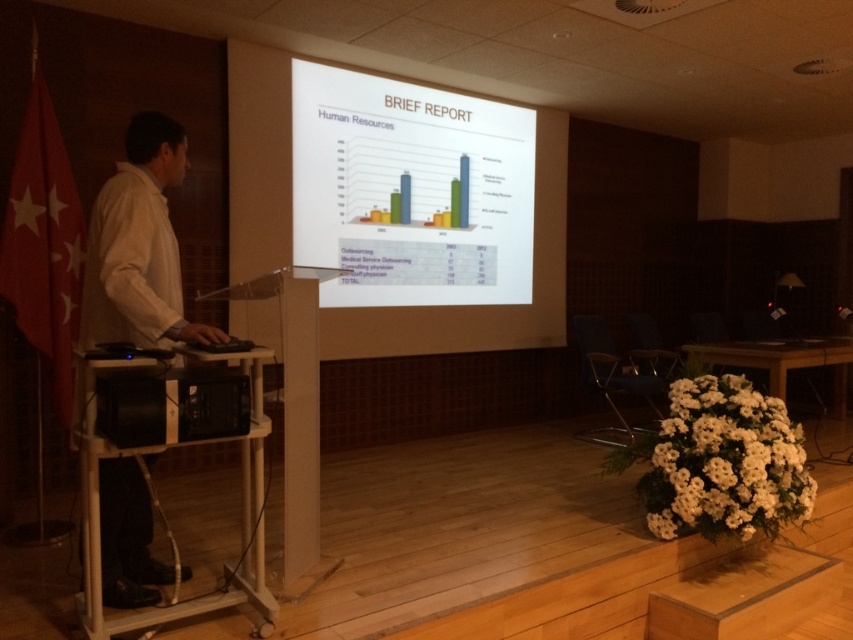
Who is more forward, (151, 257) or (199, 358)?

Point (199, 358) is in front.

Can you confirm if white shirt at left is thinner than wooden podium at center?

Yes.

Does point (96, 273) come farther from viewer compared to point (253, 538)?

No, it is not.

I want to click on white shirt at left, so click(138, 244).

Who is higher up, white glossy projector screen at upper center or wooden podium at center?

white glossy projector screen at upper center is higher up.

Does white glossy projector screen at upper center appear on the left side of wooden podium at center?

Incorrect, white glossy projector screen at upper center is not on the left side of wooden podium at center.

Is point (283, 113) closer to viewer compared to point (252, 451)?

No, it is behind (252, 451).

Where is `white glossy projector screen at upper center`? The width and height of the screenshot is (853, 640). white glossy projector screen at upper center is located at coordinates (477, 305).

Does wooden podium at center appear under black plastic speaker at lower left?

Correct, wooden podium at center is located below black plastic speaker at lower left.

The height and width of the screenshot is (640, 853). What are the coordinates of `wooden podium at center` in the screenshot? It's located at (163, 509).

Identify the location of wooden podium at center. (163, 509).